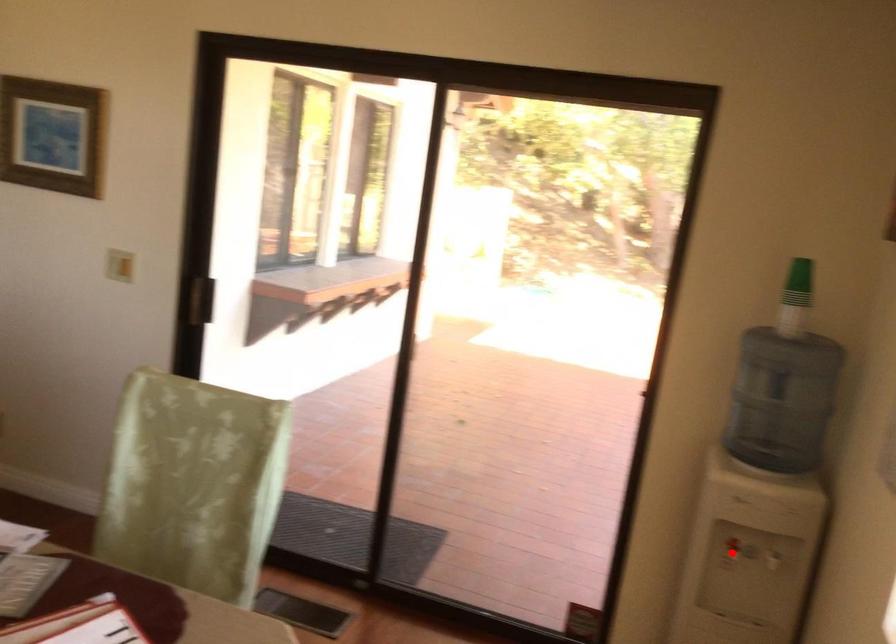
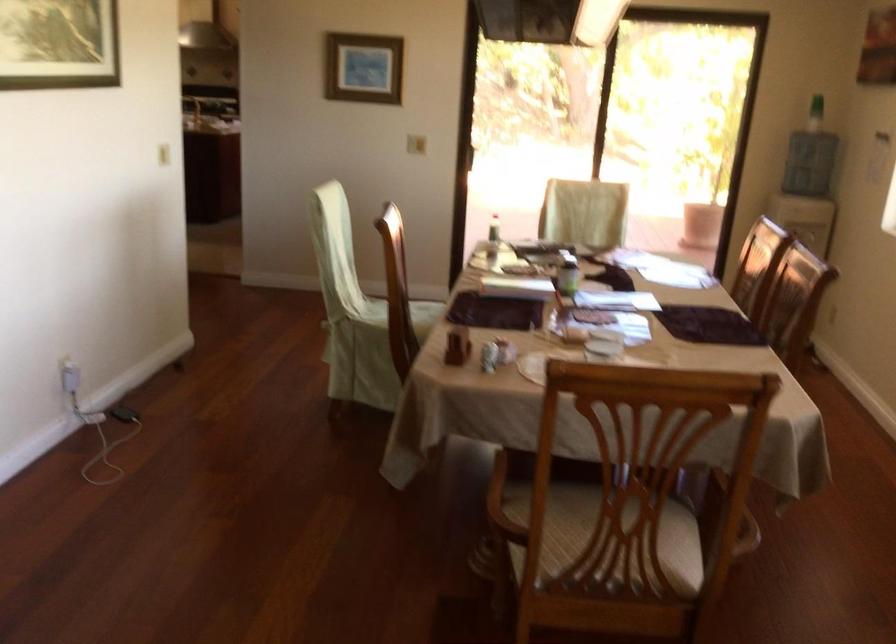
Question: I am providing you with two images of the same scene from different viewpoints. A red point is marked on the first image. Is the red point's position out of view in image 2?

Choices:
 (A) Yes
 (B) No

Answer: (A)